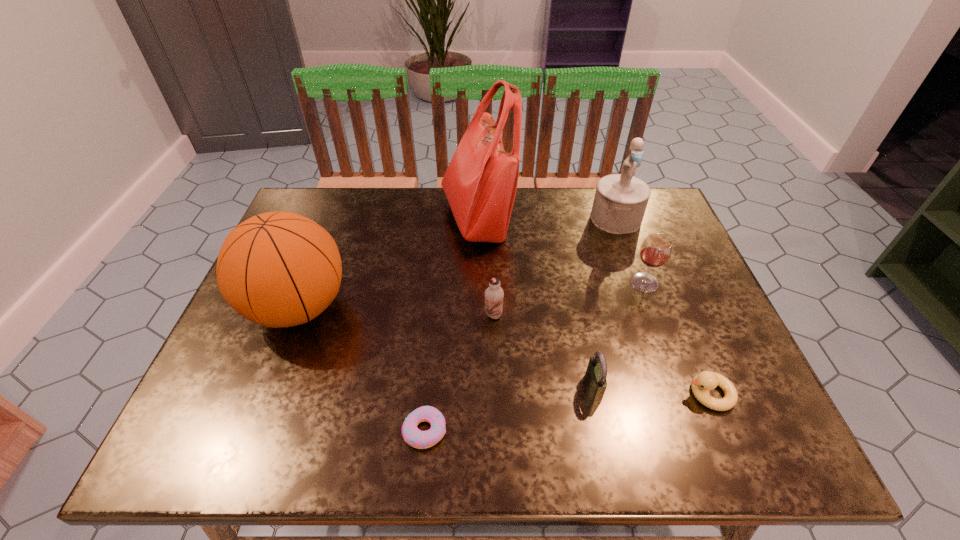
Image resolution: width=960 pixels, height=540 pixels. Find the location of `the tallest object`. the tallest object is located at coordinates (480, 183).

Locate an element on the screen. Image resolution: width=960 pixels, height=540 pixels. figurine is located at coordinates (620, 201).

Locate an element on the screen. This screenshot has width=960, height=540. the leftmost object is located at coordinates (279, 269).

This screenshot has width=960, height=540. I want to click on wineglass, so pyautogui.click(x=656, y=249).

I want to click on chocolate milk, so click(x=494, y=294).

This screenshot has height=540, width=960. What are the coordinates of `the fourth object from right to left` in the screenshot? It's located at (595, 378).

Identify the location of duckling. This screenshot has height=540, width=960. (702, 383).

Locate an element on the screen. The height and width of the screenshot is (540, 960). the shortest object is located at coordinates tap(414, 437).

The image size is (960, 540). Find the location of `vacant space located on the front-facing side of the tallest object`. vacant space located on the front-facing side of the tallest object is located at coordinates [534, 218].

What are the coordinates of `free space located 0.050m at the beak of the figurine` in the screenshot? It's located at (625, 246).